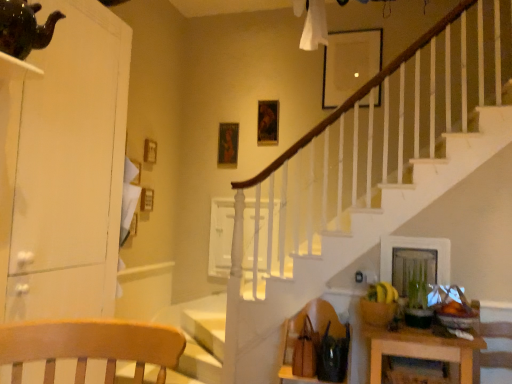
Question: From a real-world perspective, is brown leather armchair at lower right over green matte plant at lower right?

Choices:
 (A) no
 (B) yes

Answer: (A)

Question: Can you confirm if brown leather armchair at lower right is positioned to the left of green matte plant at lower right?

Choices:
 (A) yes
 (B) no

Answer: (A)

Question: Is brown leather armchair at lower right turned away from green matte plant at lower right?

Choices:
 (A) no
 (B) yes

Answer: (A)

Question: Is brown leather armchair at lower right at the right side of green matte plant at lower right?

Choices:
 (A) yes
 (B) no

Answer: (B)

Question: Considering the relative sizes of brown leather armchair at lower right and green matte plant at lower right in the image provided, is brown leather armchair at lower right taller than green matte plant at lower right?

Choices:
 (A) no
 (B) yes

Answer: (B)

Question: Does point (377, 334) appear closer or farther from the camera than point (414, 279)?

Choices:
 (A) closer
 (B) farther

Answer: (A)

Question: Visually, is wooden table at lower right positioned to the left or to the right of green matte plant at lower right?

Choices:
 (A) left
 (B) right

Answer: (A)

Question: Relative to green matte plant at lower right, is wooden table at lower right in front or behind?

Choices:
 (A) behind
 (B) front

Answer: (B)

Question: From a real-world perspective, relative to green matte plant at lower right, is wooden table at lower right vertically above or below?

Choices:
 (A) below
 (B) above

Answer: (A)

Question: Considering the relative positions of metallic gold picture frame at upper center, marked as the third picture frame in a front-to-back arrangement, and wooden picture frame at upper center, which appears as the 2th picture frame when viewed from the front, in the image provided, is metallic gold picture frame at upper center, marked as the third picture frame in a front-to-back arrangement, to the left or to the right of wooden picture frame at upper center, which appears as the 2th picture frame when viewed from the front,?

Choices:
 (A) left
 (B) right

Answer: (A)

Question: In the image, is metallic gold picture frame at upper center, marked as the third picture frame in a front-to-back arrangement, positioned in front of or behind wooden picture frame at upper center, the 2th picture frame positioned from the right?

Choices:
 (A) front
 (B) behind

Answer: (B)

Question: Is metallic gold picture frame at upper center, the 1th picture frame in the left-to-right sequence, taller or shorter than wooden picture frame at upper center, which appears as the 2th picture frame when viewed from the front?

Choices:
 (A) tall
 (B) short

Answer: (A)

Question: Is metallic gold picture frame at upper center, marked as the third picture frame in a front-to-back arrangement, wider or thinner than wooden picture frame at upper center, the 2th picture frame positioned from the right?

Choices:
 (A) wide
 (B) thin

Answer: (B)

Question: Does point (415, 284) appear closer or farther from the camera than point (373, 349)?

Choices:
 (A) farther
 (B) closer

Answer: (A)

Question: Looking at their shapes, would you say green matte plant at lower right is wider or thinner than wooden table at lower right?

Choices:
 (A) wide
 (B) thin

Answer: (B)